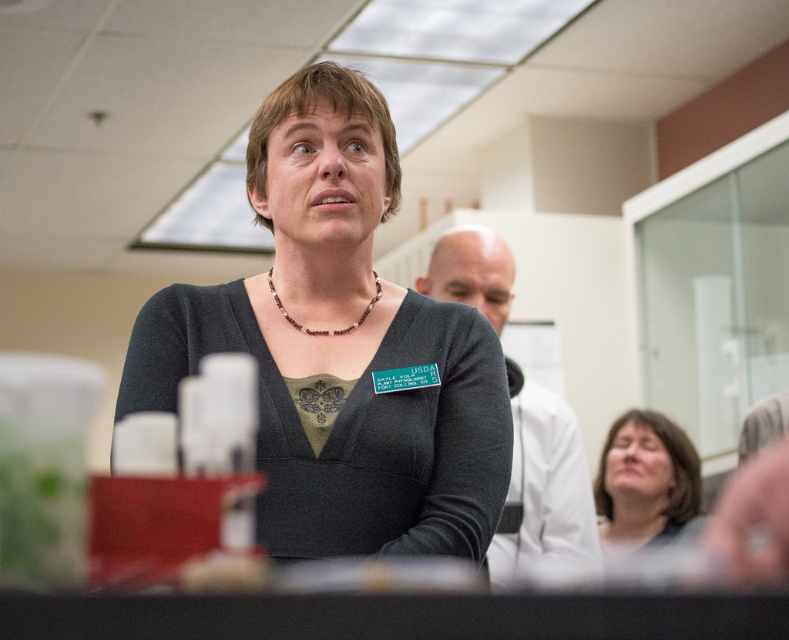
From the picture: You are an event organizer who needs to arrange seating for a group photo. The attendees include the person wearing the matte black sweater at center and the person wearing the matte gray sweater at lower right. Based on their current positions, which sweater is closer to the camera?

The matte black sweater at center is closer to the camera because it is in front of the matte gray sweater at lower right.

You are standing in the conference room and need to find the matte black sweater at center. According to the scene description, where exactly is it positioned?

The matte black sweater at center is located at point (350, 417).